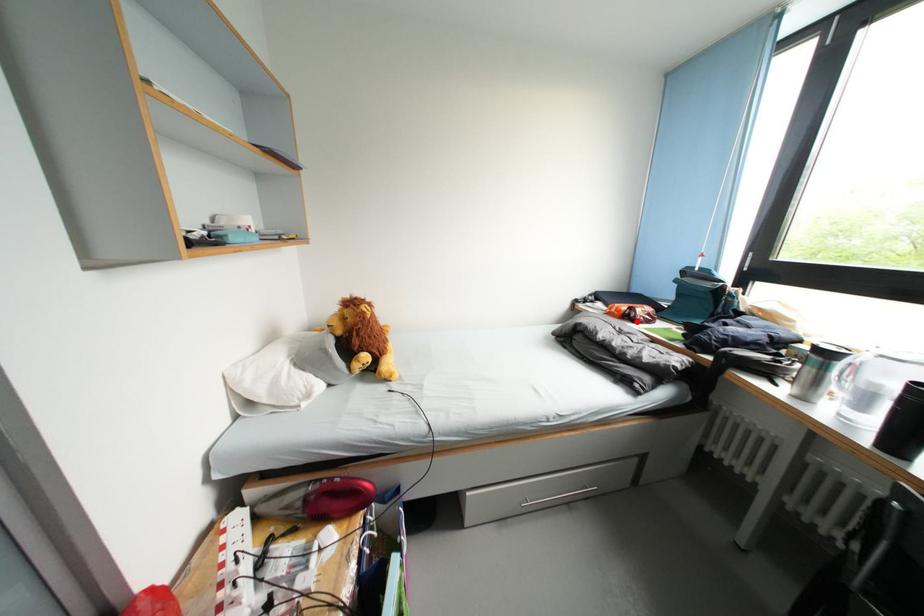
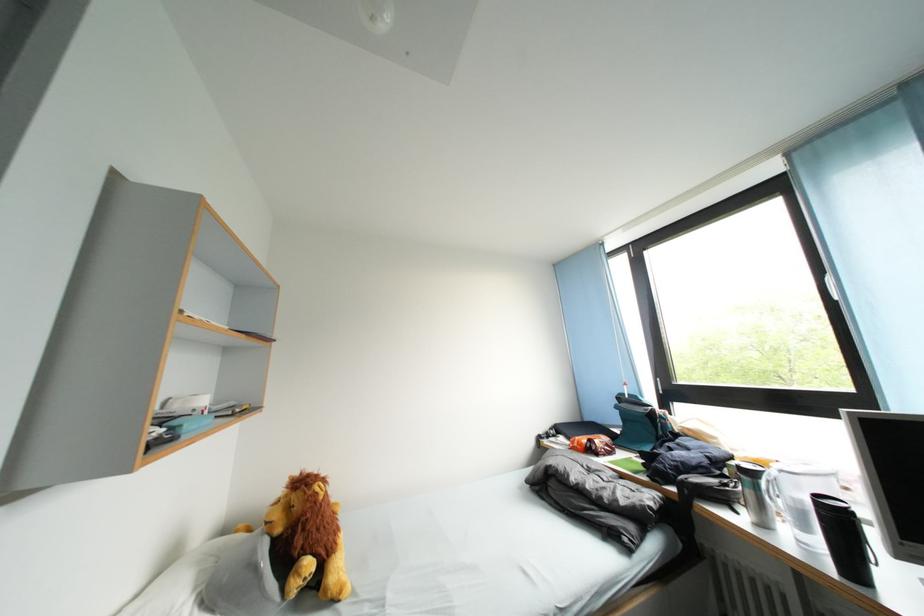
Locate, in the second image, the point that corresponds to the highlighted location in the first image.

(600, 455)